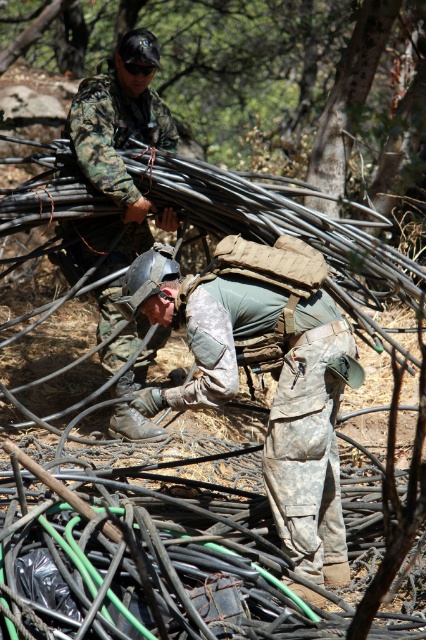
You are a soldier in the forest and you see a point at coordinates (276, 385). What object is this point located on?

The point at coordinates (276, 385) is located on the camouflage fabric helmet at center.

You are a drone operator controlling a drone that needs to hover above the point closer to you between point [331,492] and point [74,109]. Which point should the drone hover above?

The drone should hover above point [331,492] because it is closer to the viewer than point [74,109].